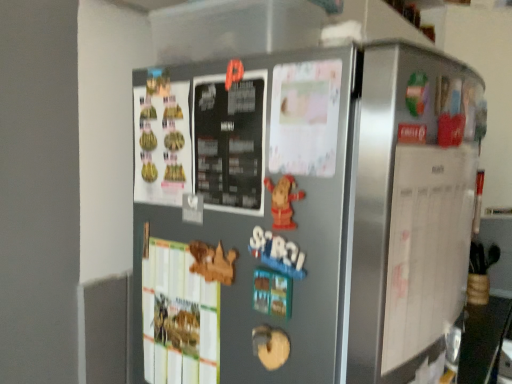
Question: Is satin silver refrigerator at center bigger or smaller than white paper at right?

Choices:
 (A) big
 (B) small

Answer: (A)

Question: From the image's perspective, is satin silver refrigerator at center above or below white paper at right?

Choices:
 (A) below
 (B) above

Answer: (A)

Question: From a real-world perspective, is satin silver refrigerator at center positioned above or below white paper at right?

Choices:
 (A) below
 (B) above

Answer: (A)

Question: Based on their positions, is white paper at right located to the left or right of satin silver refrigerator at center?

Choices:
 (A) right
 (B) left

Answer: (A)

Question: Looking at the image, does white paper at right seem bigger or smaller compared to satin silver refrigerator at center?

Choices:
 (A) big
 (B) small

Answer: (B)

Question: Considering the positions of white paper at right and satin silver refrigerator at center in the image, is white paper at right wider or thinner than satin silver refrigerator at center?

Choices:
 (A) wide
 (B) thin

Answer: (B)

Question: In the image, is white paper at right positioned in front of or behind satin silver refrigerator at center?

Choices:
 (A) front
 (B) behind

Answer: (B)